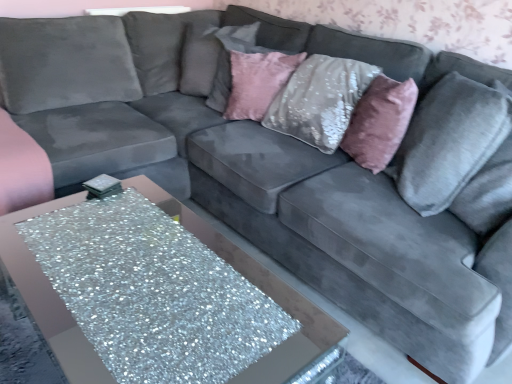
Question: Should I look upward or downward to see pink velvet pillow at upper center, the 2th pillow positioned from the left?

Choices:
 (A) up
 (B) down

Answer: (A)

Question: Which direction should I rotate to look at velvet gray pillow at upper center, placed as the 1th pillow when sorted from back to front?

Choices:
 (A) right
 (B) left

Answer: (B)

Question: Does glittery silver table at lower left turn towards velvet gray pillow at right, the first pillow positioned from the right?

Choices:
 (A) no
 (B) yes

Answer: (A)

Question: Is glittery silver table at lower left in front of velvet gray pillow at right, the first pillow positioned from the right?

Choices:
 (A) no
 (B) yes

Answer: (B)

Question: Considering the relative positions of glittery silver table at lower left and velvet gray pillow at right, the first pillow positioned from the right, in the image provided, is glittery silver table at lower left behind velvet gray pillow at right, the first pillow positioned from the right,?

Choices:
 (A) yes
 (B) no

Answer: (B)

Question: Considering the relative positions of glittery silver table at lower left and velvet gray pillow at right, which is counted as the 3th pillow, starting from the back, in the image provided, is glittery silver table at lower left to the left of velvet gray pillow at right, which is counted as the 3th pillow, starting from the back, from the viewer's perspective?

Choices:
 (A) yes
 (B) no

Answer: (A)

Question: Does glittery silver table at lower left have a lesser width compared to velvet gray pillow at right, marked as the third pillow in a left-to-right arrangement?

Choices:
 (A) no
 (B) yes

Answer: (A)

Question: Is glittery silver table at lower left in contact with velvet gray pillow at right, the first pillow positioned from the right?

Choices:
 (A) yes
 (B) no

Answer: (B)

Question: From a real-world perspective, is pink plush throw pillow at upper right positioned under glittery silver table at lower left based on gravity?

Choices:
 (A) no
 (B) yes

Answer: (A)

Question: Does pink plush throw pillow at upper right lie behind glittery silver table at lower left?

Choices:
 (A) no
 (B) yes

Answer: (B)

Question: Would you consider pink plush throw pillow at upper right to be distant from glittery silver table at lower left?

Choices:
 (A) no
 (B) yes

Answer: (B)

Question: Does pink plush throw pillow at upper right have a greater height compared to glittery silver table at lower left?

Choices:
 (A) no
 (B) yes

Answer: (B)

Question: Is pink plush throw pillow at upper right bigger than glittery silver table at lower left?

Choices:
 (A) no
 (B) yes

Answer: (A)

Question: Is pink plush throw pillow at upper right with glittery silver table at lower left?

Choices:
 (A) yes
 (B) no

Answer: (B)

Question: Is pink velvet pillow at upper center, which ranks as the second pillow in front-to-back order, placed right next to velvet gray pillow at upper center, the 3th pillow when ordered from front to back?

Choices:
 (A) yes
 (B) no

Answer: (B)